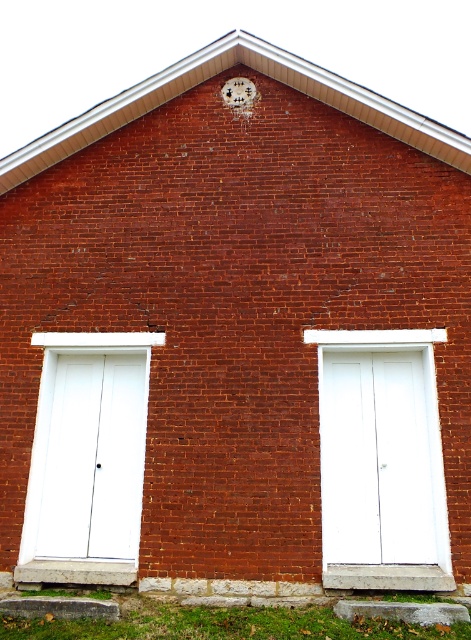
Question: Which point is farther to the camera?

Choices:
 (A) white wood door at center
 (B) white matte door at left

Answer: (B)

Question: Is the position of white wood door at center less distant than that of white matte door at left?

Choices:
 (A) no
 (B) yes

Answer: (B)

Question: Is white wood door at center closer to the viewer compared to white matte door at left?

Choices:
 (A) no
 (B) yes

Answer: (B)

Question: Is white wood door at center wider than white matte door at left?

Choices:
 (A) yes
 (B) no

Answer: (A)

Question: Among these points, which one is farthest from the camera?

Choices:
 (A) (324, 404)
 (B) (140, 449)

Answer: (B)